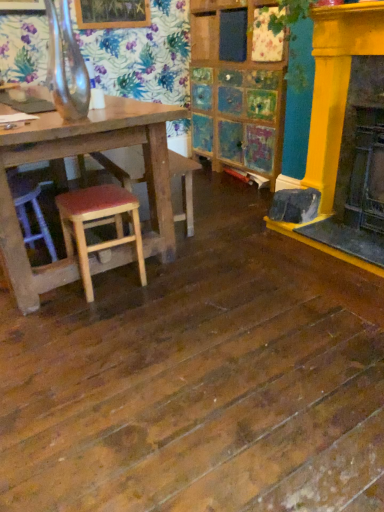
What do you see at coordinates (336, 87) in the screenshot? The height and width of the screenshot is (512, 384). I see `yellow painted wood fireplace at right` at bounding box center [336, 87].

Find the location of a particular element. yellow painted wood fireplace at right is located at coordinates (336, 87).

Find the location of a particular element. Image resolution: width=384 pixels, height=512 pixels. yellow painted wood fireplace at right is located at coordinates (336, 87).

Based on the photo, considering the relative sizes of wooden seat at center and wooden stool with red cushion at lower left in the image provided, is wooden seat at center thinner than wooden stool with red cushion at lower left?

In fact, wooden seat at center might be wider than wooden stool with red cushion at lower left.

From the image's perspective, which one is positioned lower, wooden seat at center or wooden stool with red cushion at lower left?

wooden stool with red cushion at lower left appears lower in the image.

Consider the image. Does wooden seat at center have a lesser height compared to wooden stool with red cushion at lower left?

No.

In the scene shown: Could you tell me if wooden seat at center is facing wooden stool with red cushion at lower left?

No, wooden seat at center is not facing towards wooden stool with red cushion at lower left.

Which is in front, point (84, 282) or point (193, 234)?

The point (84, 282) is more forward.

Is wooden stool with red cushion at lower left positioned far away from wooden seat at center?

No, wooden stool with red cushion at lower left is not far from wooden seat at center.

Can you confirm if wooden stool with red cushion at lower left is thinner than wooden seat at center?

Indeed, wooden stool with red cushion at lower left has a lesser width compared to wooden seat at center.

Looking at their sizes, would you say yellow painted wood fireplace at right is wider or thinner than wooden stool with red cushion at lower left?

In the image, yellow painted wood fireplace at right appears to be more narrow than wooden stool with red cushion at lower left.

Does yellow painted wood fireplace at right have a larger size compared to wooden stool with red cushion at lower left?

Correct, yellow painted wood fireplace at right is larger in size than wooden stool with red cushion at lower left.

From the image's perspective, would you say yellow painted wood fireplace at right is shown under wooden stool with red cushion at lower left?

Incorrect, from the image's perspective, yellow painted wood fireplace at right is higher than wooden stool with red cushion at lower left.

Is yellow painted wood fireplace at right taller than wooden stool with red cushion at lower left?

Correct, yellow painted wood fireplace at right is much taller as wooden stool with red cushion at lower left.

From a real-world perspective, relative to yellow painted wood fireplace at right, is wooden seat at center vertically above or below?

wooden seat at center is below yellow painted wood fireplace at right.

Which is nearer, (108, 170) or (295, 234)?

Point (108, 170) appears to be farther away from the viewer than point (295, 234).

Between wooden seat at center and yellow painted wood fireplace at right, which one has larger size?

wooden seat at center is bigger.

Is wooden seat at center turned away from yellow painted wood fireplace at right?

Yes, wooden seat at center is facing away from yellow painted wood fireplace at right.

Which is in front, point (362, 6) or point (130, 187)?

The point (362, 6) is more forward.

Locate an element on the screen. The width and height of the screenshot is (384, 512). fireplace above the wooden seat at center (from the image's perspective) is located at coordinates (336, 87).

Is yellow painted wood fireplace at right at the right side of wooden seat at center?

Correct, you'll find yellow painted wood fireplace at right to the right of wooden seat at center.

Looking at the image, does wooden stool with red cushion at lower left seem bigger or smaller compared to yellow painted wood fireplace at right?

wooden stool with red cushion at lower left is smaller than yellow painted wood fireplace at right.

From a real-world perspective, is wooden stool with red cushion at lower left positioned above or below yellow painted wood fireplace at right?

wooden stool with red cushion at lower left is situated lower than yellow painted wood fireplace at right in the real world.

How many degrees apart are the facing directions of wooden stool with red cushion at lower left and yellow painted wood fireplace at right?

92 degrees separate the facing orientations of wooden stool with red cushion at lower left and yellow painted wood fireplace at right.

Is wooden stool with red cushion at lower left facing towards yellow painted wood fireplace at right?

No, wooden stool with red cushion at lower left does not turn towards yellow painted wood fireplace at right.

You are a GUI agent. You are given a task and a screenshot of the screen. Output one action in this format:
    pyautogui.click(x=<x>, y=<y>)
    Task: Click on the stool below the wooden seat at center (from a real-world perspective)
    
    Given the screenshot: What is the action you would take?
    pyautogui.click(x=98, y=225)

The height and width of the screenshot is (512, 384). I want to click on bar stool on the left side of wooden stool with red cushion at lower left, so click(x=123, y=165).

Looking at the image, which one is located closer to wooden stool with red cushion at lower left, yellow painted wood fireplace at right or wooden seat at center?

wooden seat at center is closer to wooden stool with red cushion at lower left.

Which object lies nearer to the anchor point wooden seat at center, yellow painted wood fireplace at right or wooden stool with red cushion at lower left?

wooden stool with red cushion at lower left lies closer to wooden seat at center than the other object.

From the image, which object appears to be nearer to wooden seat at center, wooden stool with red cushion at lower left or yellow painted wood fireplace at right?

Based on the image, wooden stool with red cushion at lower left appears to be nearer to wooden seat at center.

Estimate the real-world distances between objects in this image. Which object is closer to yellow painted wood fireplace at right, wooden seat at center or wooden stool with red cushion at lower left?

wooden seat at center lies closer to yellow painted wood fireplace at right than the other object.

Considering their positions, is wooden seat at center positioned further to wooden stool with red cushion at lower left than yellow painted wood fireplace at right?

yellow painted wood fireplace at right is further to wooden stool with red cushion at lower left.

Based on their spatial positions, is wooden stool with red cushion at lower left or wooden seat at center closer to yellow painted wood fireplace at right?

The object closer to yellow painted wood fireplace at right is wooden seat at center.

Find the location of a particular element. The width and height of the screenshot is (384, 512). stool between wooden seat at center and yellow painted wood fireplace at right in the horizontal direction is located at coordinates (98, 225).